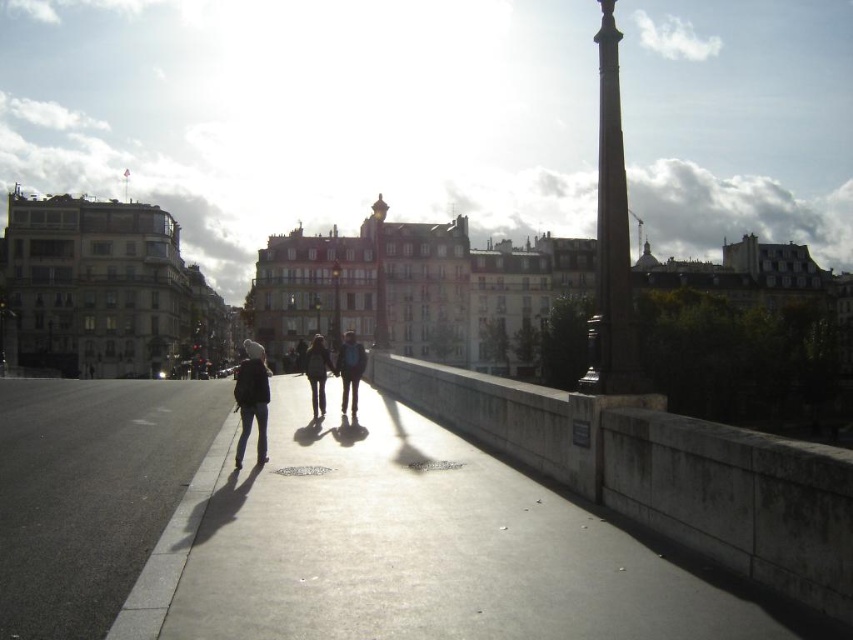
Does gray concrete pavement at lower left appear on the right side of matte black jacket at center?

No, gray concrete pavement at lower left is not to the right of matte black jacket at center.

Can you confirm if gray concrete pavement at lower left is positioned below matte black jacket at center?

Indeed, gray concrete pavement at lower left is positioned under matte black jacket at center.

Does point (172, 410) come behind point (343, 353)?

Yes.

Locate an element on the screen. This screenshot has height=640, width=853. gray concrete pavement at lower left is located at coordinates (90, 492).

Locate an element on the screen. This screenshot has width=853, height=640. polished stone column at right is located at coordinates tap(611, 236).

Which is in front, point (605, 6) or point (316, 397)?

Point (605, 6)

The image size is (853, 640). In order to click on polished stone column at right in this screenshot , I will do `click(611, 236)`.

Is dark gray knit hat at center to the right of matte black jacket at center from the viewer's perspective?

Indeed, dark gray knit hat at center is positioned on the right side of matte black jacket at center.

Between dark gray knit hat at center and matte black jacket at center, which one has less height?

dark gray knit hat at center is shorter.

Image resolution: width=853 pixels, height=640 pixels. Describe the element at coordinates (251, 400) in the screenshot. I see `dark gray knit hat at center` at that location.

The image size is (853, 640). In order to click on dark gray knit hat at center in this screenshot , I will do `click(251, 400)`.